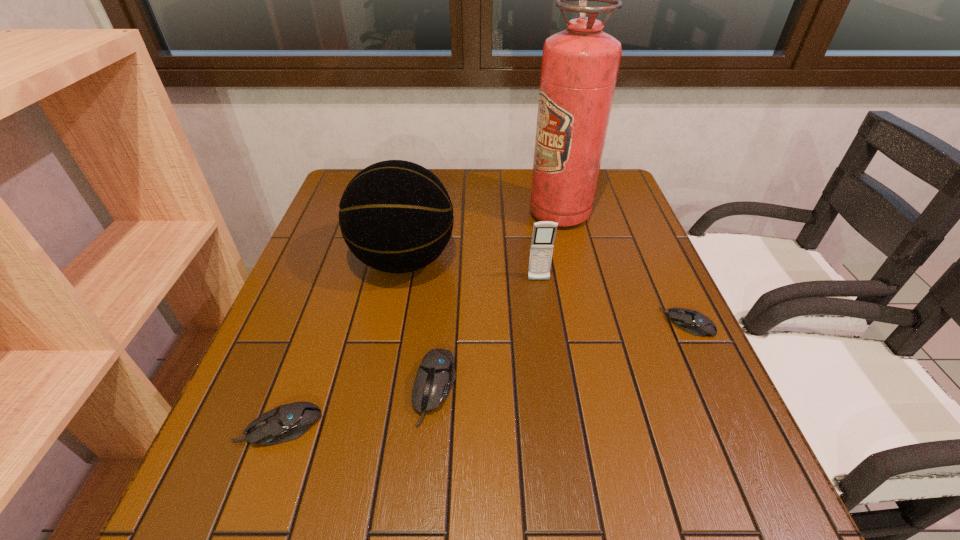
Identify the location of free space for an extra mouse_(computer_equipment) to achieve even spacing. (569, 353).